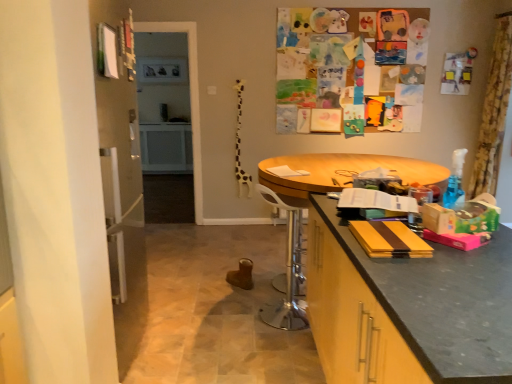
I want to click on free spot in front of white plastic swivel chair at center, so click(x=275, y=344).